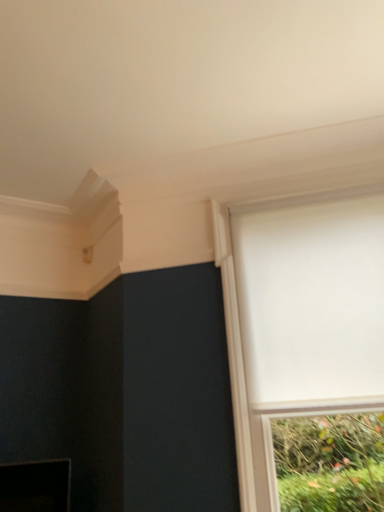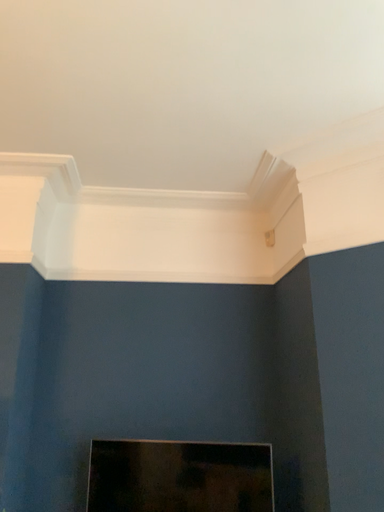
Question: How did the camera likely rotate when shooting the video?

Choices:
 (A) rotated right
 (B) rotated left

Answer: (B)